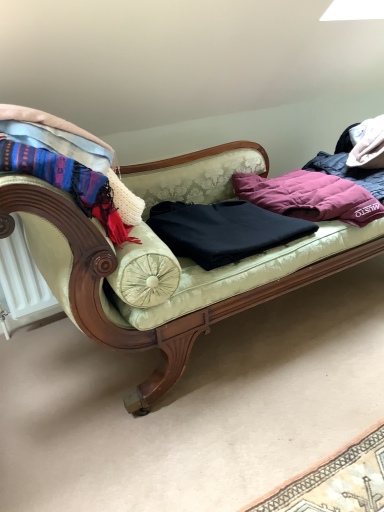
Question: From a real-world perspective, is purple down jacket at center, marked as the 2th clothing in a left-to-right arrangement, positioned above or below knitted wool scarf at left?

Choices:
 (A) below
 (B) above

Answer: (A)

Question: Would you say purple down jacket at center, marked as the 2th clothing in a left-to-right arrangement, is inside or outside knitted wool scarf at left?

Choices:
 (A) outside
 (B) inside

Answer: (A)

Question: Considering the real-world distances, which object is farthest from the knitted wool scarf at left?

Choices:
 (A) purple down jacket at center, marked as the 2th clothing in a left-to-right arrangement
 (B) black matte sweater at center, the first clothing positioned from the left
 (C) velvet green couch at center

Answer: (A)

Question: Which object is the farthest from the black matte sweater at center, placed as the second clothing when sorted from right to left?

Choices:
 (A) purple down jacket at center, positioned as the 1th clothing in right-to-left order
 (B) velvet green couch at center
 (C) knitted wool scarf at left

Answer: (C)